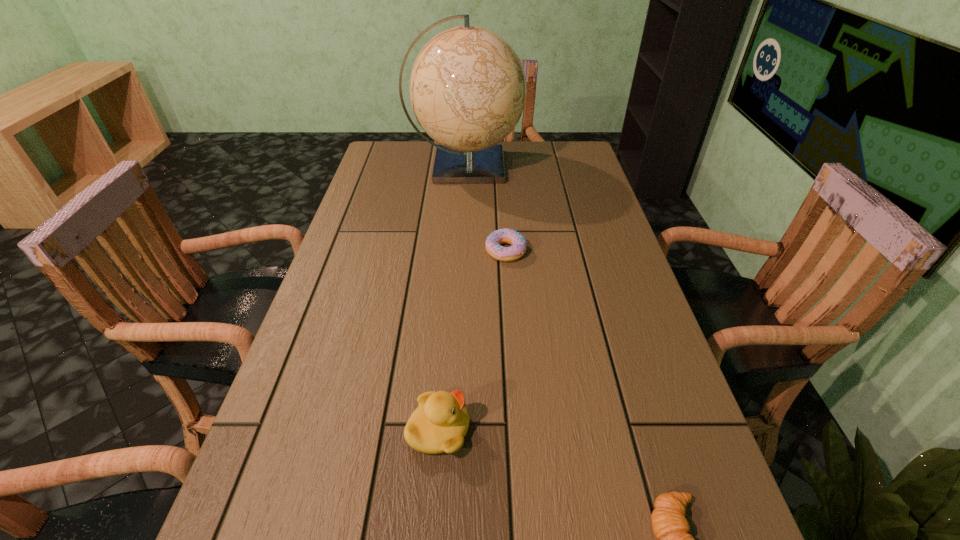
What are the coordinates of `globe` in the screenshot? It's located at (467, 86).

Where is `the tallest object`? the tallest object is located at coordinates (467, 86).

Find the location of a particular element. The height and width of the screenshot is (540, 960). duckling is located at coordinates (439, 424).

This screenshot has height=540, width=960. Find the location of `the third farthest object`. the third farthest object is located at coordinates (439, 424).

Where is `doughnut`? The height and width of the screenshot is (540, 960). doughnut is located at coordinates (506, 235).

You are a GUI agent. You are given a task and a screenshot of the screen. Output one action in this format:
    pyautogui.click(x=<x>, y=<y>)
    Task: Click on the free point located on the surface of the tallest object showing Europe and Africa
    The image size is (960, 540).
    Given the screenshot: What is the action you would take?
    pyautogui.click(x=591, y=166)

The image size is (960, 540). Identify the location of blank space located on the beak of the duckling. (681, 430).

The image size is (960, 540). I want to click on vacant space located on the front of the doughnut, so click(x=513, y=347).

I want to click on object situated at the far edge, so click(x=467, y=86).

You are a GUI agent. You are given a task and a screenshot of the screen. Output one action in this format:
    pyautogui.click(x=<x>, y=<y>)
    Task: Click on the object that is at the left edge
    The height and width of the screenshot is (540, 960).
    Given the screenshot: What is the action you would take?
    pyautogui.click(x=467, y=86)